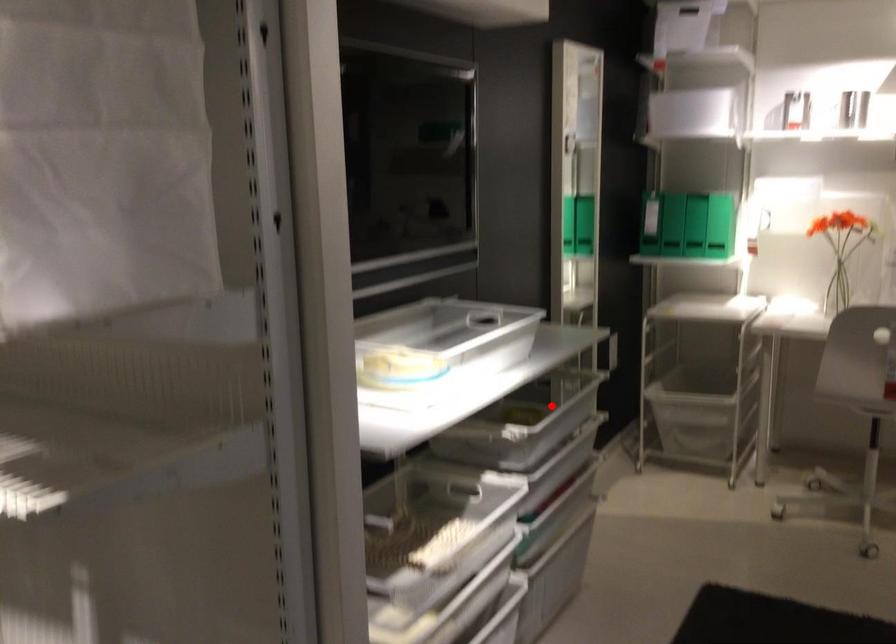
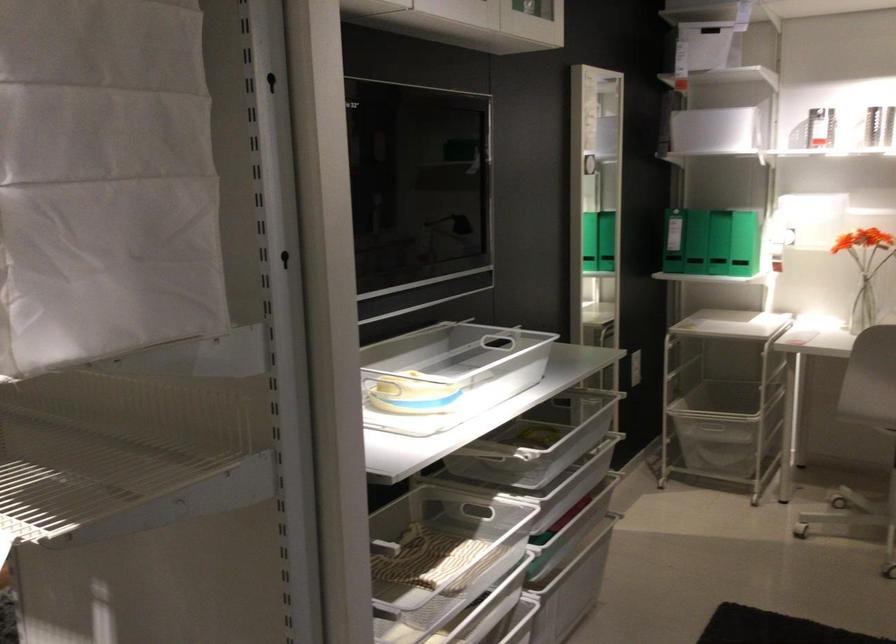
The point at the highlighted location is marked in the first image. Where is the corresponding point in the second image?

(561, 428)